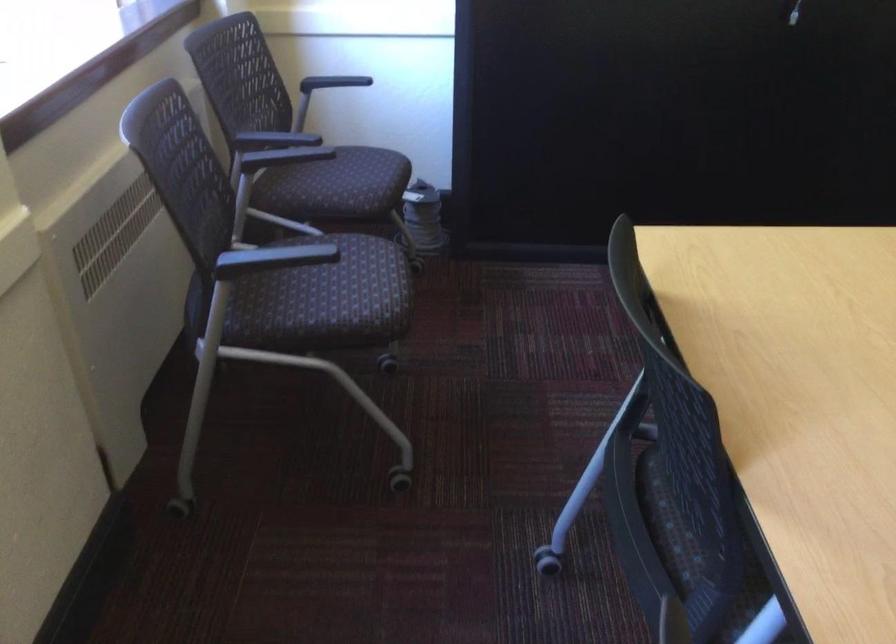
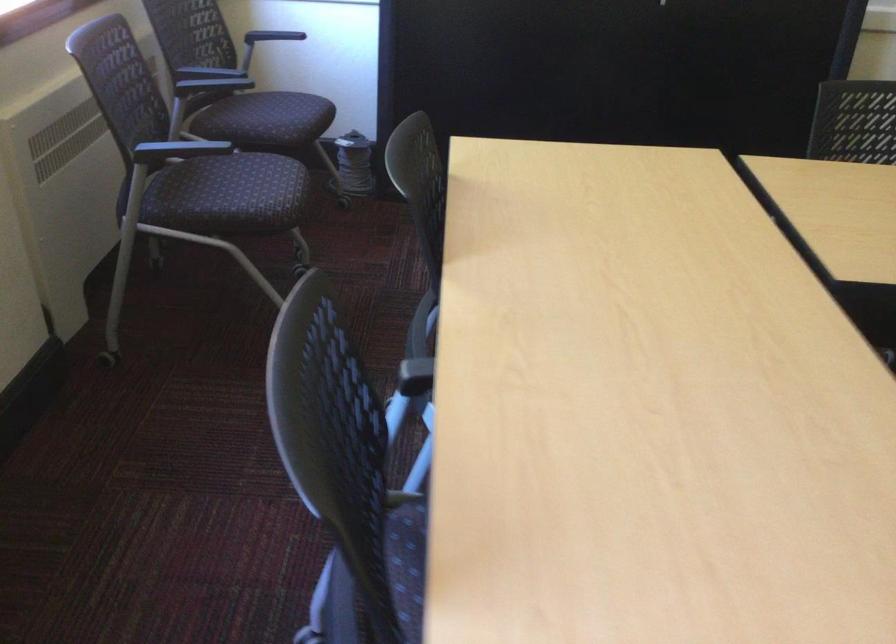
Where in the second image is the point corresponding to (x=348, y=305) from the first image?

(250, 198)